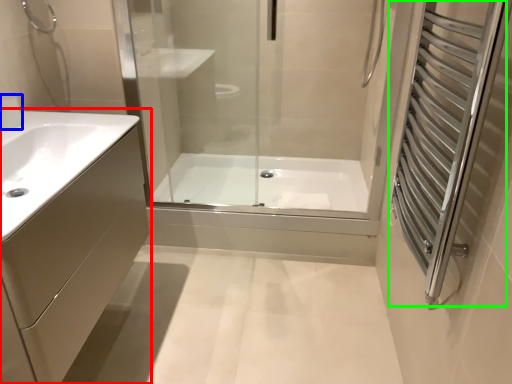
Question: Estimate the real-world distances between objects in this image. Which object is farther from bathroom cabinet (highlighted by a red box), faucet (highlighted by a blue box) or screen door (highlighted by a green box)?

Choices:
 (A) faucet
 (B) screen door

Answer: (B)